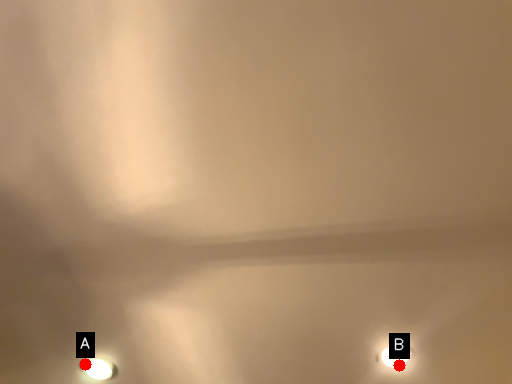
Question: Two points are circled on the image, labeled by A and B beside each circle. Which of the following is the farthest from the observer?

Choices:
 (A) A is further
 (B) B is further

Answer: (B)